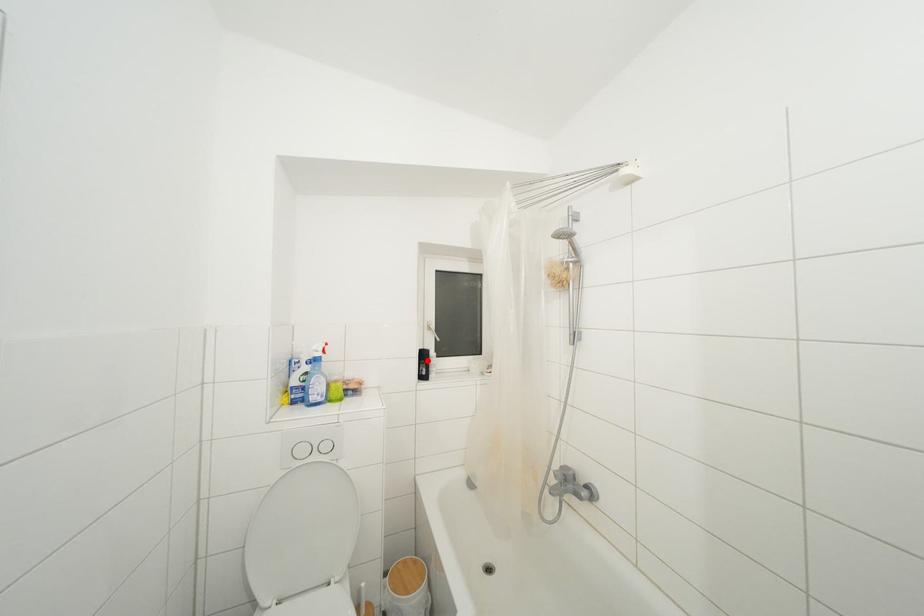
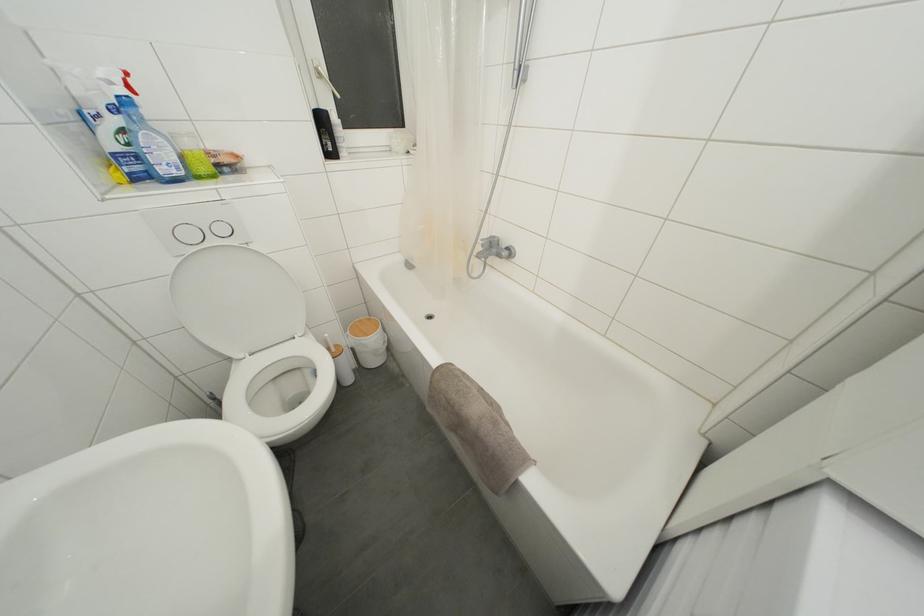
In the second image, find the point that corresponds to the highlighted location in the first image.

(325, 126)